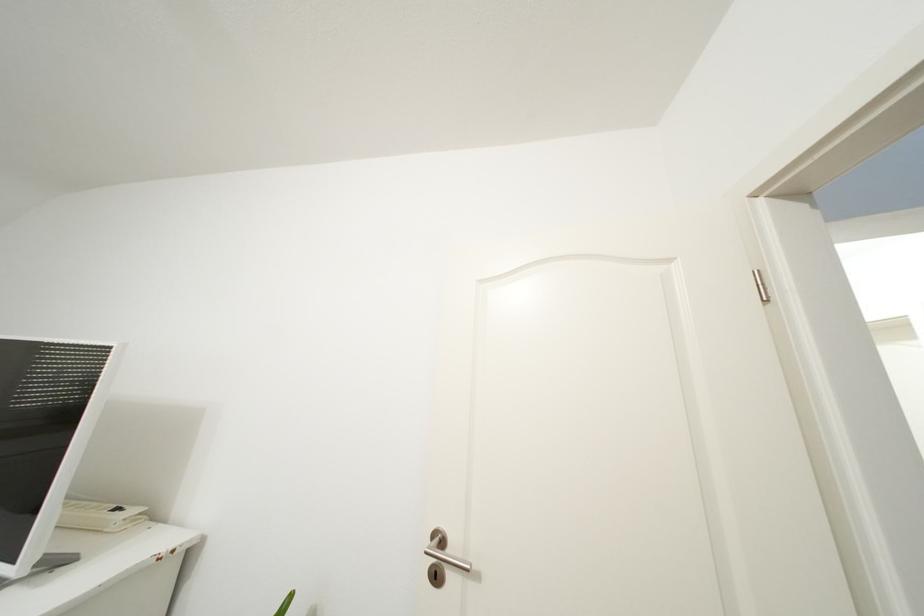
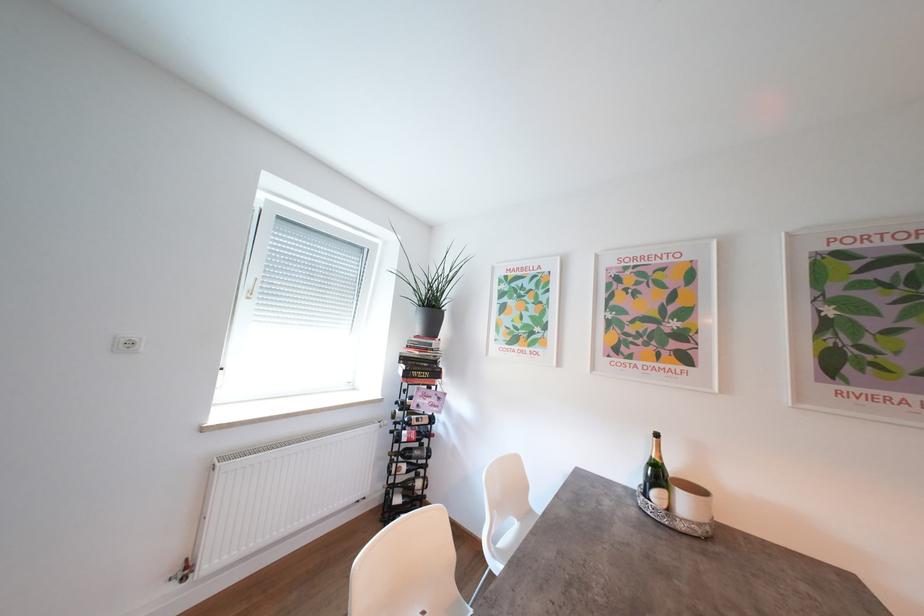
What movement of the cameraman would produce the second image?

The cameraman walked toward left, forward.